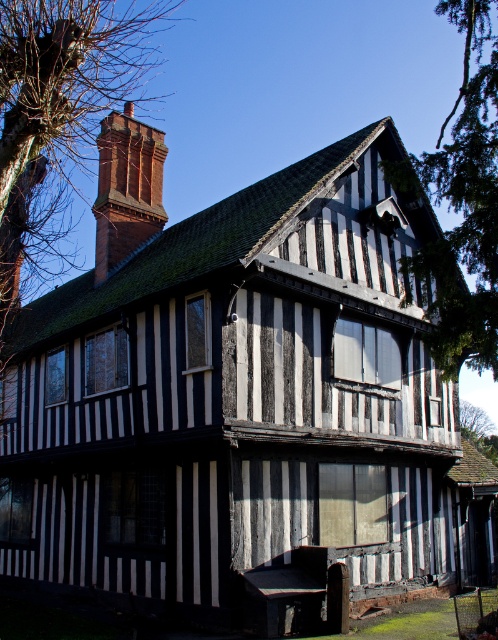
You are standing in front of a traditional timber building with two points marked on its facade. The first point is at coordinates point (477, 348) and the second is at point (160, 193). Which of these points is closer to you?

Point (477, 348) is in front of point (160, 193), so it is closer to you.

You are standing in front of the traditional timber building and want to take a photo of the brick chimney at upper left and green leafy tree at upper right. Which object is positioned more to the right side of the building?

The green leafy tree at upper right is positioned more to the right side of the building than the brick chimney at upper left.

You are a photographer planning to capture the traditional timber building in the image. You want to ensure that both the green leafy tree at upper right and the brick chimney at upper left are visible in your shot. Given their heights, which object will appear larger in the photo?

The green leafy tree at upper right is much taller than the brick chimney at upper left, so it will appear larger in the photo.